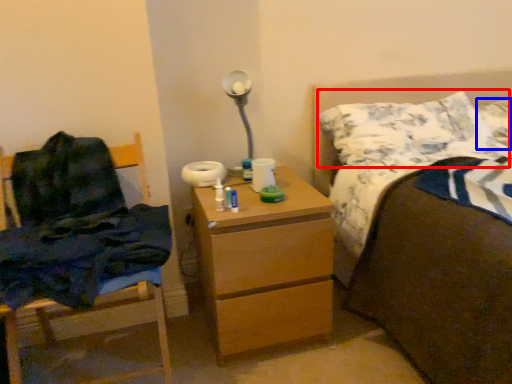
Question: Which object is further to the camera taking this photo, pillow (highlighted by a red box) or pillow (highlighted by a blue box)?

Choices:
 (A) pillow
 (B) pillow

Answer: (B)